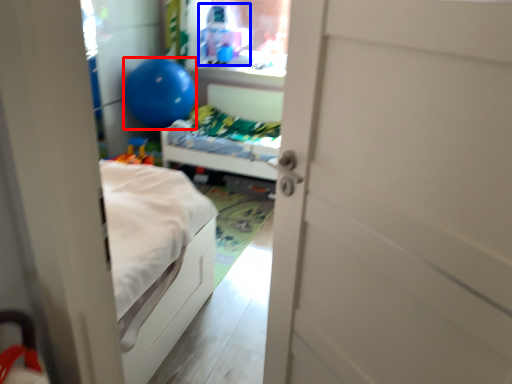
Question: Which object appears closest to the camera in this image, balloon (highlighted by a red box) or toy (highlighted by a blue box)?

Choices:
 (A) balloon
 (B) toy

Answer: (A)